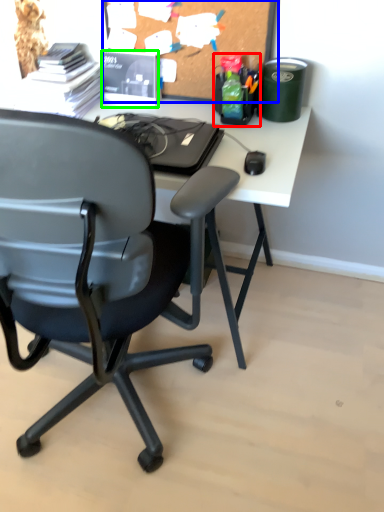
Question: Which is nearer to the stationery (highlighted by a red box)? bulletin board (highlighted by a blue box) or stationery (highlighted by a green box).

Choices:
 (A) bulletin board
 (B) stationery

Answer: (A)